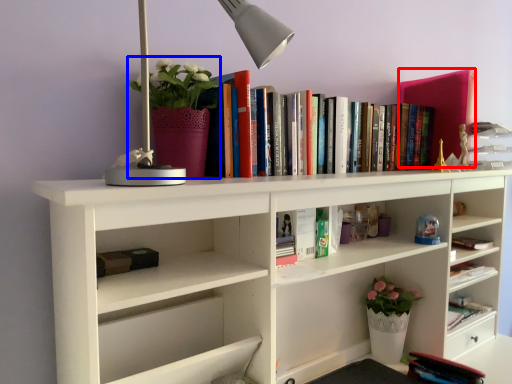
Question: Which point is closer to the camera, paperback book (highlighted by a red box) or floral arrangement (highlighted by a blue box)?

Choices:
 (A) paperback book
 (B) floral arrangement

Answer: (B)